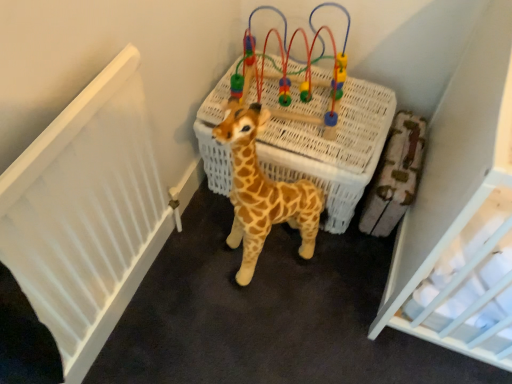
The width and height of the screenshot is (512, 384). Find the location of `vacant area that is situated to the right of spotted plush giraffe at center`. vacant area that is situated to the right of spotted plush giraffe at center is located at coordinates (337, 277).